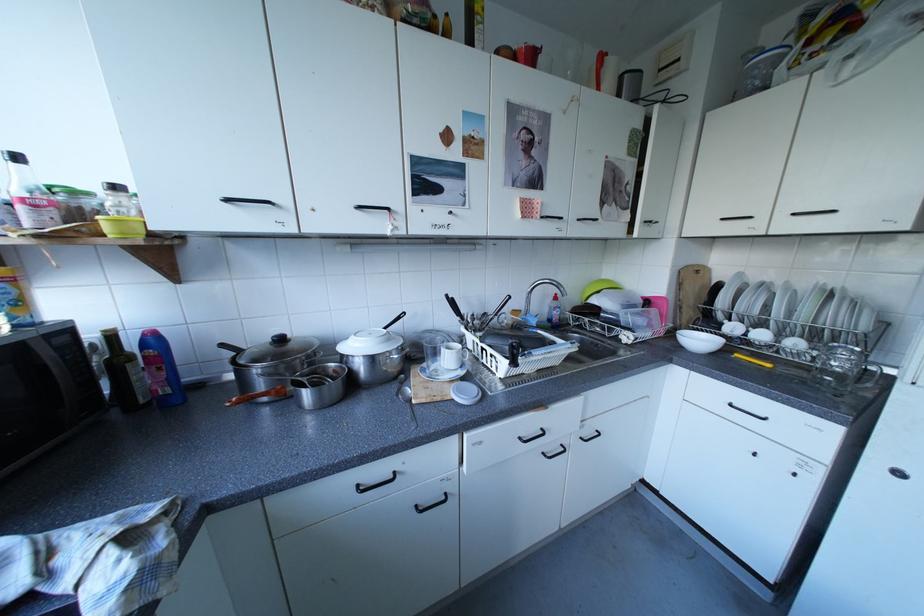
What do you see at coordinates (369, 342) in the screenshot? This screenshot has height=616, width=924. I see `the white pot lid handle` at bounding box center [369, 342].